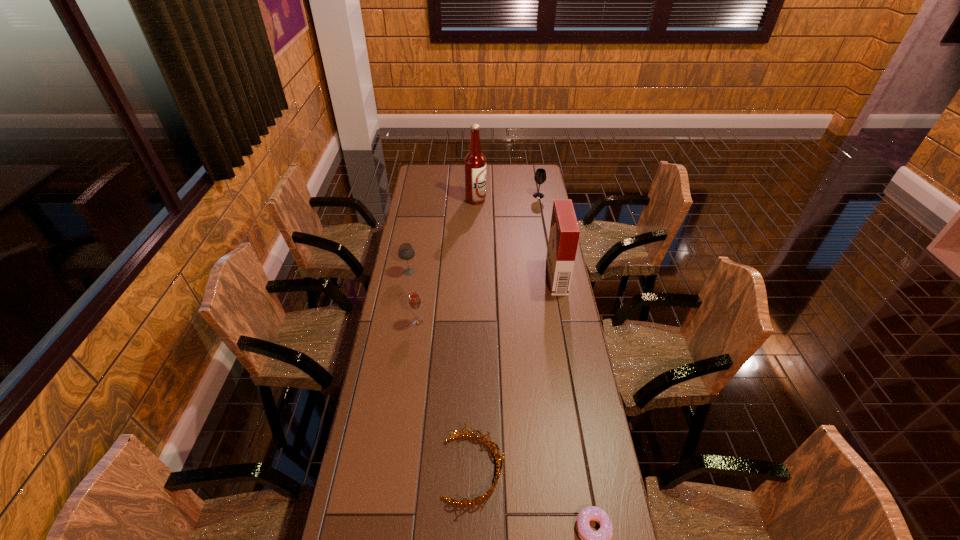
You are a GUI agent. You are given a task and a screenshot of the screen. Output one action in this format:
    pyautogui.click(x=<x>, y=<y>)
    Task: Click on the free location located 0.380m on the front-facing side of the second tallest object
    This screenshot has height=540, width=960.
    Given the screenshot: What is the action you would take?
    pyautogui.click(x=459, y=278)

This screenshot has width=960, height=540. What are the coordinates of `vacant space located 0.110m on the front-facing side of the second tallest object` in the screenshot? It's located at (522, 278).

At what (x,y) coordinates should I click in order to perform the action: click on vacant space situated 0.360m on the front-facing side of the second tallest object. Please return your answer as a coordinate pair (x, y). The height and width of the screenshot is (540, 960). Looking at the image, I should click on (464, 278).

Identify the location of vacant space located 0.300m on the left of the rightmost wineglass. This screenshot has height=540, width=960. (476, 195).

The height and width of the screenshot is (540, 960). I want to click on vacant area situated 0.090m on the back of the nearest wineglass, so click(420, 299).

Locate an element on the screen. The image size is (960, 540). vacant point located 0.280m on the back of the leftmost wineglass is located at coordinates (417, 228).

Identify the location of vacant space situated on the front-facing side of the tiara. (592, 469).

The image size is (960, 540). In order to click on cigarette_case positioned at the right edge in this screenshot , I will do [x=564, y=233].

Locate an element on the screen. wineglass located at the right edge is located at coordinates (540, 176).

In the image, there is a desktop. Identify the location of vacant space at the far edge. This screenshot has width=960, height=540. (516, 170).